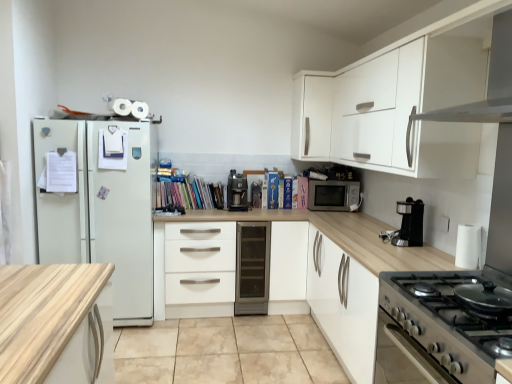
What are the coordinates of `vacant area that lies in front of metallic coffee maker at center` in the screenshot? It's located at (248, 210).